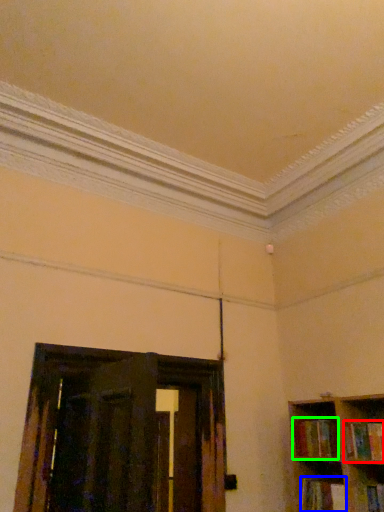
Question: Which object is the closest to the book (highlighted by a red box)? Choose among these: book (highlighted by a blue box) or book (highlighted by a green box).

Choices:
 (A) book
 (B) book

Answer: (B)